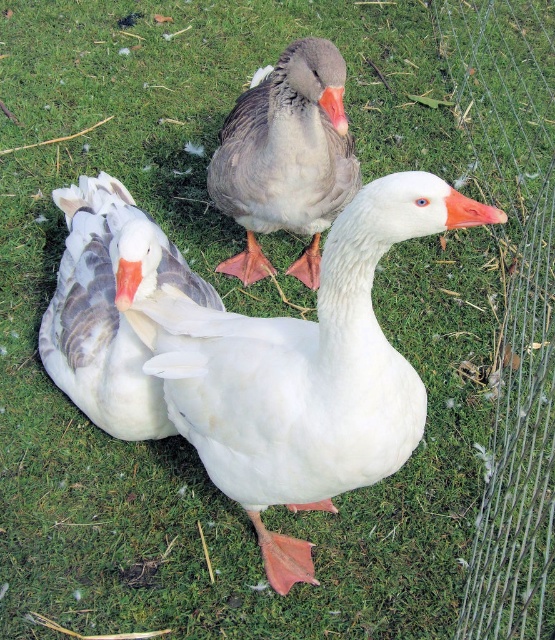
Does white matte duck at center appear on the right side of gray matte goose at center?

In fact, white matte duck at center is to the left of gray matte goose at center.

Who is more forward, (280,588) or (285,227)?

Point (280,588) is more forward.

The image size is (555, 640). Identify the location of white matte duck at center. (302, 371).

Find the location of a particular element. This screenshot has width=555, height=640. white matte duck at center is located at coordinates (302, 371).

Which is more to the right, white matte goose at center or gray matte goose at center?

From the viewer's perspective, gray matte goose at center appears more on the right side.

Between point (139, 406) and point (255, 145), which one is positioned in front?

Point (139, 406)

This screenshot has height=640, width=555. Identify the location of white matte goose at center. (111, 307).

Is wire mesh fence at right to the left of gray matte goose at center from the viewer's perspective?

No, wire mesh fence at right is not to the left of gray matte goose at center.

Which is behind, point (552, 273) or point (317, 276)?

The point (552, 273) is behind.

This screenshot has width=555, height=640. What are the coordinates of `wire mesh fence at right` in the screenshot? It's located at (512, 301).